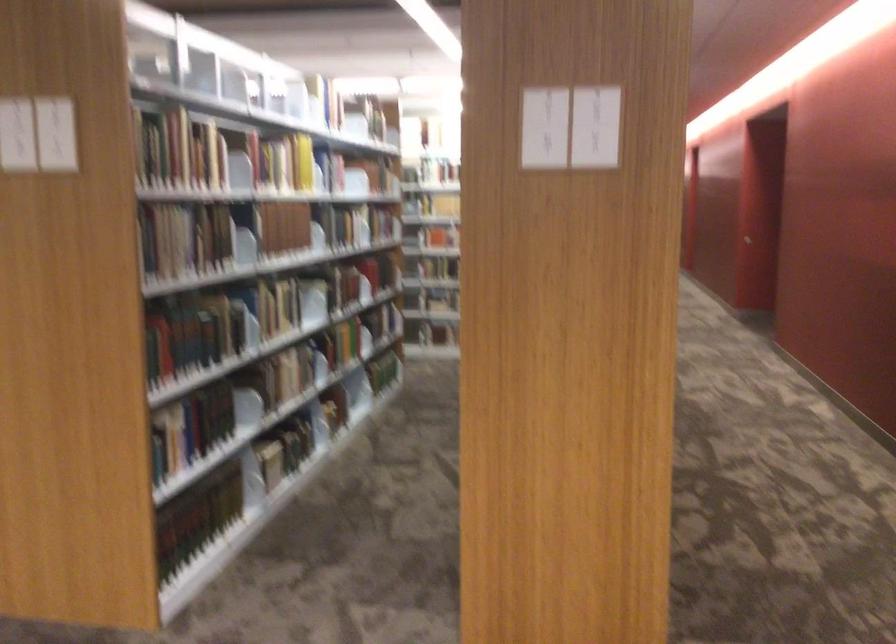
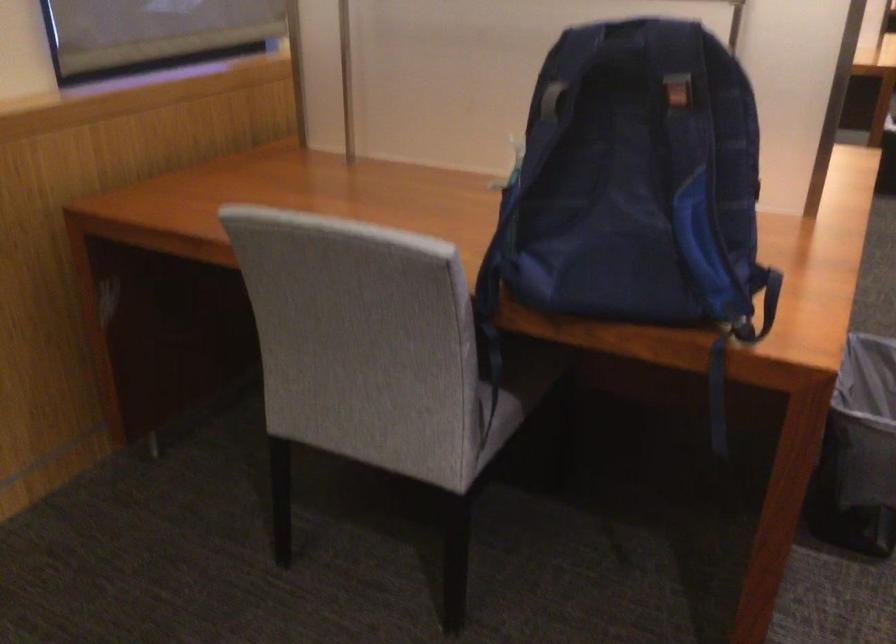
The first image is from the beginning of the video and the second image is from the end. How did the camera likely rotate when shooting the video?

The camera rotated toward left-down.